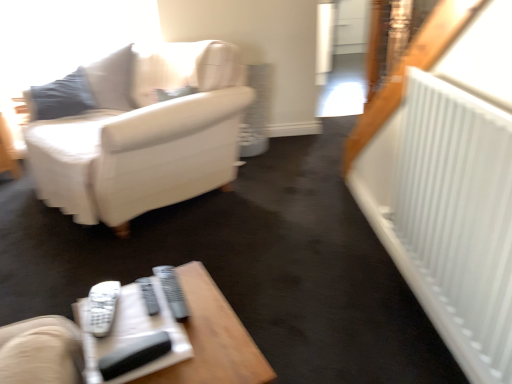
Locate an element on the screen. The width and height of the screenshot is (512, 384). free spot to the right of gray plastic remote at center, which appears as the first remote when viewed from the right is located at coordinates (207, 302).